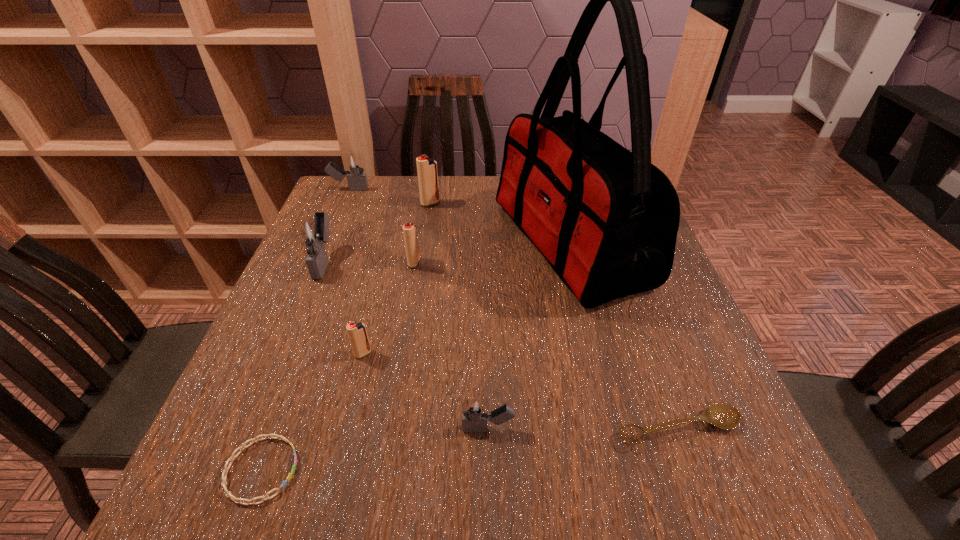
Identify the location of vacant space that satisfies the following two spatial constraints: 1. on the back side of the second nearest red igniter; 2. on the left side of the second farthest igniter. The height and width of the screenshot is (540, 960). (424, 204).